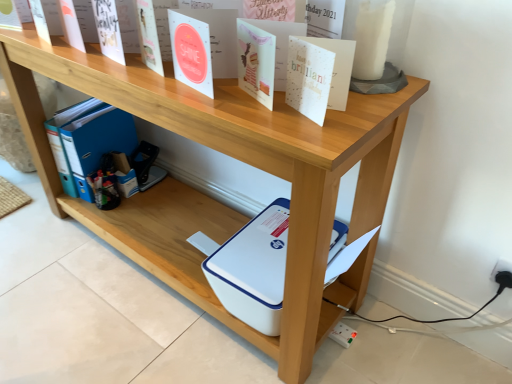
Image resolution: width=512 pixels, height=384 pixels. Find the location of `vacant area that is in front of white paper at upper center, which is the 2th paperback book from back to front`. vacant area that is in front of white paper at upper center, which is the 2th paperback book from back to front is located at coordinates (314, 137).